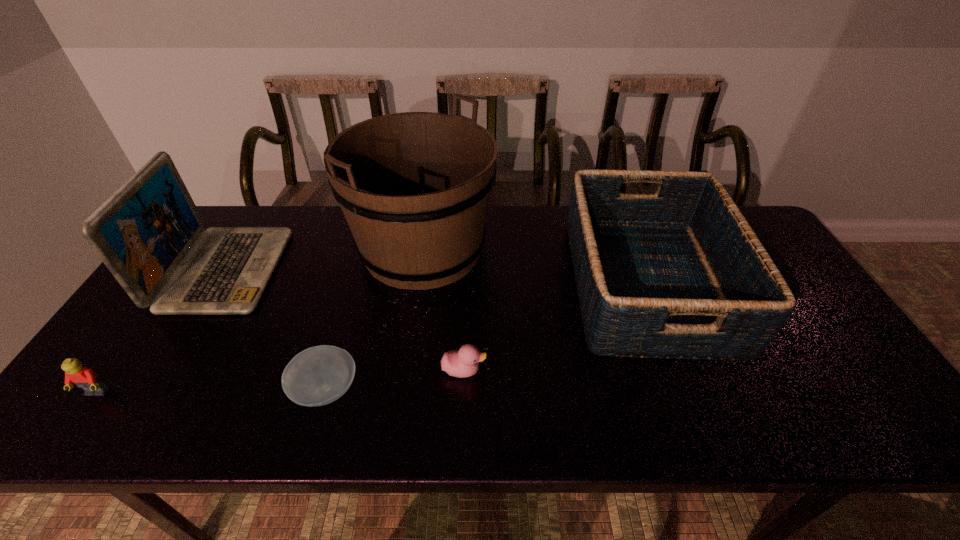
At what (x,y) coordinates should I click in order to perform the action: click on bucket. Please return your answer as a coordinate pair (x, y). Looking at the image, I should click on (414, 187).

You are a GUI agent. You are given a task and a screenshot of the screen. Output one action in this format:
    pyautogui.click(x=<x>, y=<y>)
    Task: Click on the fifth shortest object
    The image size is (960, 540).
    Given the screenshot: What is the action you would take?
    pyautogui.click(x=150, y=226)

You are a GUI agent. You are given a task and a screenshot of the screen. Output one action in this format:
    pyautogui.click(x=<x>, y=<y>)
    Task: Click on the fourth shortest object
    
    Given the screenshot: What is the action you would take?
    pyautogui.click(x=680, y=274)

At what (x,y) coordinates should I click in order to perform the action: click on basket. Please return your answer as a coordinate pair (x, y). Looking at the image, I should click on (680, 274).

The image size is (960, 540). Find the location of `the third shortest object`. the third shortest object is located at coordinates (85, 378).

Find the location of a particular element. the fifth tallest object is located at coordinates (461, 363).

This screenshot has width=960, height=540. In order to click on bowl in this screenshot , I will do `click(319, 375)`.

Identify the location of free space located on the right of the tallest object. (511, 248).

The image size is (960, 540). I want to click on free region located on the screen of the second tallest object, so click(x=297, y=270).

The height and width of the screenshot is (540, 960). Find the location of `vacant space located on the back of the basket`. vacant space located on the back of the basket is located at coordinates (618, 208).